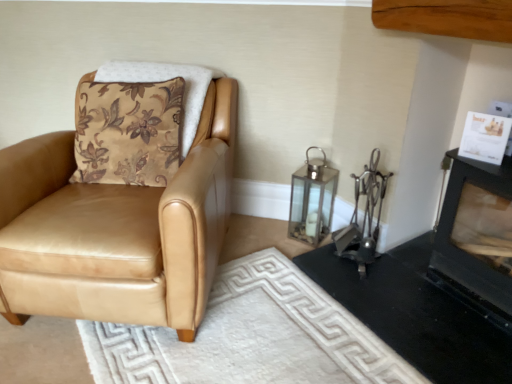
Locate an element on the screen. vacant region to the left of black matte fireplace at upper right, acting as the 1th fireplace starting from the top is located at coordinates (416, 304).